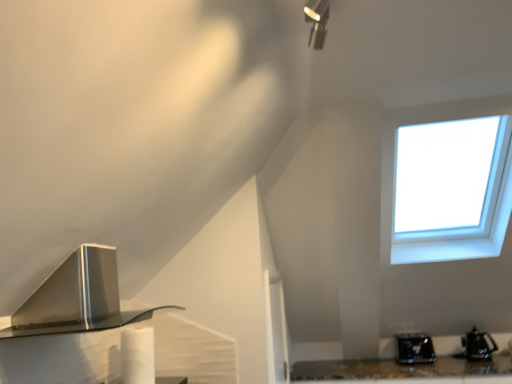
Describe the element at coordinates (414, 348) in the screenshot. I see `shiny black toaster at lower right, which is the 2th appliance from right to left` at that location.

You are a GUI agent. You are given a task and a screenshot of the screen. Output one action in this format:
    pyautogui.click(x=<x>, y=<y>)
    Task: Click on the shiny black toaster at lower right, which is the 2th appliance from right to left
    Image resolution: width=512 pixels, height=384 pixels.
    Given the screenshot: What is the action you would take?
    pyautogui.click(x=414, y=348)

Locate an element on the screen. This screenshot has width=512, height=384. black plastic kettle at lower right, marked as the 2th appliance in a left-to-right arrangement is located at coordinates (478, 345).

At what (x,y) coordinates should I click in order to perform the action: click on shiny black toaster at lower right, the first appliance positioned from the left. Please return your answer as a coordinate pair (x, y). The width and height of the screenshot is (512, 384). Looking at the image, I should click on (414, 348).

Between shiny black toaster at lower right, the first appliance positioned from the left, and black plastic kettle at lower right, placed as the 1th appliance when sorted from right to left, which one has smaller width?

With smaller width is black plastic kettle at lower right, placed as the 1th appliance when sorted from right to left.

Who is taller, shiny black toaster at lower right, the first appliance positioned from the left, or black plastic kettle at lower right, placed as the 1th appliance when sorted from right to left?

shiny black toaster at lower right, the first appliance positioned from the left, is taller.

From the image's perspective, is shiny black toaster at lower right, the first appliance positioned from the left, on top of black plastic kettle at lower right, marked as the 2th appliance in a left-to-right arrangement?

Incorrect, from the image's perspective, shiny black toaster at lower right, the first appliance positioned from the left, is lower than black plastic kettle at lower right, marked as the 2th appliance in a left-to-right arrangement.

Which of these two, satin silver range hood at lower left or shiny black toaster at lower right, the first appliance positioned from the left, is wider?

satin silver range hood at lower left.

Is satin silver range hood at lower left beside shiny black toaster at lower right, the first appliance positioned from the left?

No, satin silver range hood at lower left is not next to shiny black toaster at lower right, the first appliance positioned from the left.

From the picture: How much distance is there between satin silver range hood at lower left and shiny black toaster at lower right, which is the 2th appliance from right to left?

They are 2.72 meters apart.

Does satin silver range hood at lower left come behind shiny black toaster at lower right, which is the 2th appliance from right to left?

No, it is in front of shiny black toaster at lower right, which is the 2th appliance from right to left.

Considering the positions of points (490, 341) and (56, 314), is point (490, 341) farther from camera compared to point (56, 314)?

Yes, point (490, 341) is farther from viewer.

Could you tell me if black plastic kettle at lower right, marked as the 2th appliance in a left-to-right arrangement, is facing satin silver range hood at lower left?

No, black plastic kettle at lower right, marked as the 2th appliance in a left-to-right arrangement, does not turn towards satin silver range hood at lower left.

Considering the sizes of objects black plastic kettle at lower right, placed as the 1th appliance when sorted from right to left, and satin silver range hood at lower left in the image provided, who is bigger, black plastic kettle at lower right, placed as the 1th appliance when sorted from right to left, or satin silver range hood at lower left?

Bigger between the two is satin silver range hood at lower left.

In terms of height, does black plastic kettle at lower right, marked as the 2th appliance in a left-to-right arrangement, look taller or shorter compared to satin silver range hood at lower left?

black plastic kettle at lower right, marked as the 2th appliance in a left-to-right arrangement, is shorter than satin silver range hood at lower left.

Consider the image. Considering the sizes of black plastic kettle at lower right, marked as the 2th appliance in a left-to-right arrangement, and shiny black toaster at lower right, which is the 2th appliance from right to left, in the image, is black plastic kettle at lower right, marked as the 2th appliance in a left-to-right arrangement, wider or thinner than shiny black toaster at lower right, which is the 2th appliance from right to left,?

In the image, black plastic kettle at lower right, marked as the 2th appliance in a left-to-right arrangement, appears to be more narrow than shiny black toaster at lower right, which is the 2th appliance from right to left.

Who is smaller, black plastic kettle at lower right, marked as the 2th appliance in a left-to-right arrangement, or shiny black toaster at lower right, which is the 2th appliance from right to left?

With smaller size is black plastic kettle at lower right, marked as the 2th appliance in a left-to-right arrangement.

The height and width of the screenshot is (384, 512). I want to click on appliance that is on the right side of shiny black toaster at lower right, the first appliance positioned from the left, so click(x=478, y=345).

Which of these two, satin silver range hood at lower left or black plastic kettle at lower right, placed as the 1th appliance when sorted from right to left, is bigger?

With larger size is satin silver range hood at lower left.

How much distance is there between satin silver range hood at lower left and black plastic kettle at lower right, marked as the 2th appliance in a left-to-right arrangement?

satin silver range hood at lower left and black plastic kettle at lower right, marked as the 2th appliance in a left-to-right arrangement, are 10.10 feet apart from each other.

Find the location of a particular element. The height and width of the screenshot is (384, 512). kitchen appliance to the left of black plastic kettle at lower right, marked as the 2th appliance in a left-to-right arrangement is located at coordinates (76, 298).

Which is more to the left, satin silver range hood at lower left or black plastic kettle at lower right, placed as the 1th appliance when sorted from right to left?

Positioned to the left is satin silver range hood at lower left.

Which is in front, shiny black toaster at lower right, the first appliance positioned from the left, or satin silver range hood at lower left?

Positioned in front is satin silver range hood at lower left.

Which object is thinner, shiny black toaster at lower right, the first appliance positioned from the left, or satin silver range hood at lower left?

With smaller width is shiny black toaster at lower right, the first appliance positioned from the left.

Is shiny black toaster at lower right, which is the 2th appliance from right to left, with satin silver range hood at lower left?

No, shiny black toaster at lower right, which is the 2th appliance from right to left, is not touching satin silver range hood at lower left.

You are a GUI agent. You are given a task and a screenshot of the screen. Output one action in this format:
    pyautogui.click(x=<x>, y=<y>)
    Task: Click on the appliance on the right side of shiny black toaster at lower right, the first appliance positioned from the left
    The height and width of the screenshot is (384, 512).
    Given the screenshot: What is the action you would take?
    pyautogui.click(x=478, y=345)

I want to click on kitchen appliance on the left of the shiny black toaster at lower right, the first appliance positioned from the left, so click(76, 298).

Estimate the real-world distances between objects in this image. Which object is further from black plastic kettle at lower right, placed as the 1th appliance when sorted from right to left, shiny black toaster at lower right, the first appliance positioned from the left, or satin silver range hood at lower left?

satin silver range hood at lower left lies further to black plastic kettle at lower right, placed as the 1th appliance when sorted from right to left, than the other object.

Which object lies further to the anchor point shiny black toaster at lower right, which is the 2th appliance from right to left, satin silver range hood at lower left or black plastic kettle at lower right, placed as the 1th appliance when sorted from right to left?

satin silver range hood at lower left is positioned further to the anchor shiny black toaster at lower right, which is the 2th appliance from right to left.

Estimate the real-world distances between objects in this image. Which object is further from shiny black toaster at lower right, the first appliance positioned from the left, black plastic kettle at lower right, marked as the 2th appliance in a left-to-right arrangement, or satin silver range hood at lower left?

Among the two, satin silver range hood at lower left is located further to shiny black toaster at lower right, the first appliance positioned from the left.

From the image, which object appears to be nearer to black plastic kettle at lower right, placed as the 1th appliance when sorted from right to left, satin silver range hood at lower left or shiny black toaster at lower right, which is the 2th appliance from right to left?

The object closer to black plastic kettle at lower right, placed as the 1th appliance when sorted from right to left, is shiny black toaster at lower right, which is the 2th appliance from right to left.

Looking at the image, which one is located closer to satin silver range hood at lower left, black plastic kettle at lower right, placed as the 1th appliance when sorted from right to left, or shiny black toaster at lower right, which is the 2th appliance from right to left?

shiny black toaster at lower right, which is the 2th appliance from right to left.

Looking at the image, which one is located closer to satin silver range hood at lower left, shiny black toaster at lower right, which is the 2th appliance from right to left, or black plastic kettle at lower right, marked as the 2th appliance in a left-to-right arrangement?

The object closer to satin silver range hood at lower left is shiny black toaster at lower right, which is the 2th appliance from right to left.

Where is `appliance between satin silver range hood at lower left and black plastic kettle at lower right, marked as the 2th appliance in a left-to-right arrangement`? This screenshot has height=384, width=512. appliance between satin silver range hood at lower left and black plastic kettle at lower right, marked as the 2th appliance in a left-to-right arrangement is located at coordinates (414, 348).